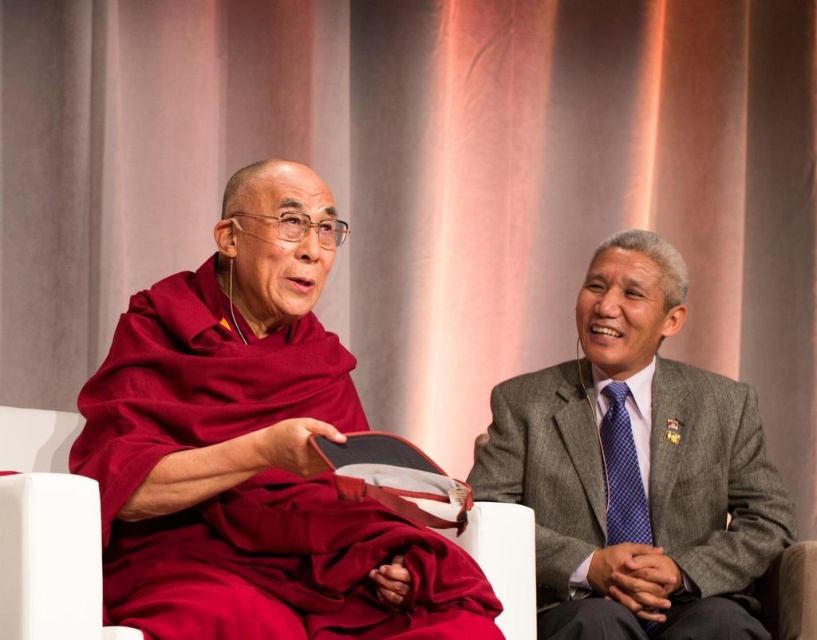
In the image, there are two people sitting against a backdrop of soft, draped curtains. The person on the left is wearing a silky maroon robe and holding a book or folder with a black and white cover. The person on the right is dressed in a formal gray suit. Where is the silky maroon robe at left located in terms of its 2D coordinates?

The silky maroon robe at left is located at the 2D coordinates point (253,451).

You are a photographer setting up for a group portrait. The two subjects are wearing the silky maroon robe at left and the gray wool suit at right. You need to position them so that there is at least 30 inches between them for proper framing. Based on the current distance, is the spacing sufficient?

The distance between the silky maroon robe at left and the gray wool suit at right is 26.13 inches. Since this is less than the required 30 inches, the spacing is insufficient for proper framing.